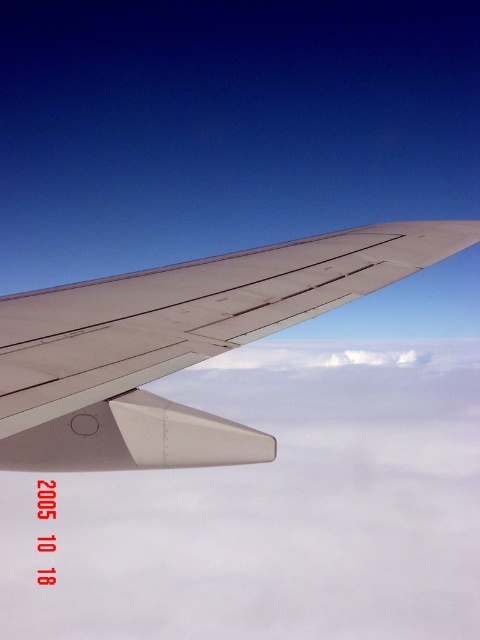
You are a passenger sitting by the window in an airplane. You see the metallic gray wing at upper center and the white fluffy cloud at center. Which object is closer to you?

The white fluffy cloud at center is closer to you because the metallic gray wing at upper center is behind it.

You are sitting in an airplane seat and looking out the window. You notice the white fluffy cloud at center. Can you determine if the cloud is directly in front of the wing or behind it based on its position?

The white fluffy cloud at center is located at point (273, 508), which places it behind the wing since the wing is the main subject occupying the foreground of the image.